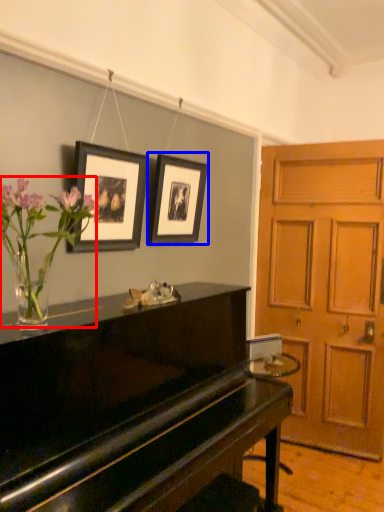
Question: Which object is closer to the camera taking this photo, floral arrangement (highlighted by a red box) or picture frame (highlighted by a blue box)?

Choices:
 (A) floral arrangement
 (B) picture frame

Answer: (A)